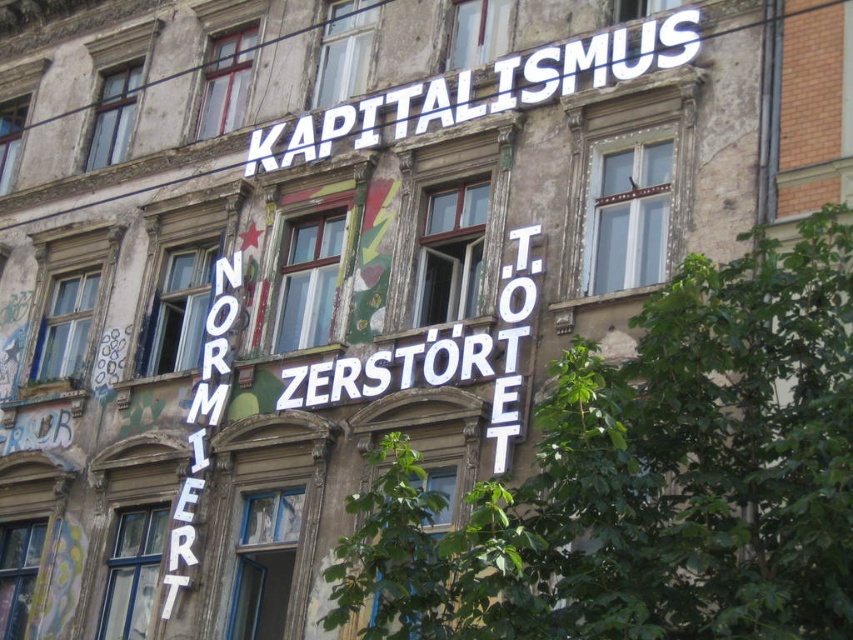
Who is more distant from viewer, (x=357, y=140) or (x=195, y=429)?

Positioned behind is point (x=357, y=140).

Who is higher up, white plastic sign at upper center or white neon sign at left?

white plastic sign at upper center is higher up.

This screenshot has height=640, width=853. What are the coordinates of `white plastic sign at upper center` in the screenshot? It's located at (480, 88).

Where is `white plastic sign at upper center`? white plastic sign at upper center is located at coordinates (480, 88).

Can you confirm if white plastic sign at upper center is positioned above white plastic letters at center?

Yes, white plastic sign at upper center is above white plastic letters at center.

Can you confirm if white plastic sign at upper center is taller than white plastic letters at center?

No, white plastic sign at upper center is not taller than white plastic letters at center.

Locate an element on the screen. white plastic sign at upper center is located at coordinates (480, 88).

Does white plastic letters at center have a lesser width compared to white neon sign at left?

In fact, white plastic letters at center might be wider than white neon sign at left.

Image resolution: width=853 pixels, height=640 pixels. Describe the element at coordinates (440, 358) in the screenshot. I see `white plastic letters at center` at that location.

Which is in front, point (422, 376) or point (195, 476)?

Point (422, 376) is in front.

In order to click on white plastic letters at center in this screenshot , I will do `click(440, 358)`.